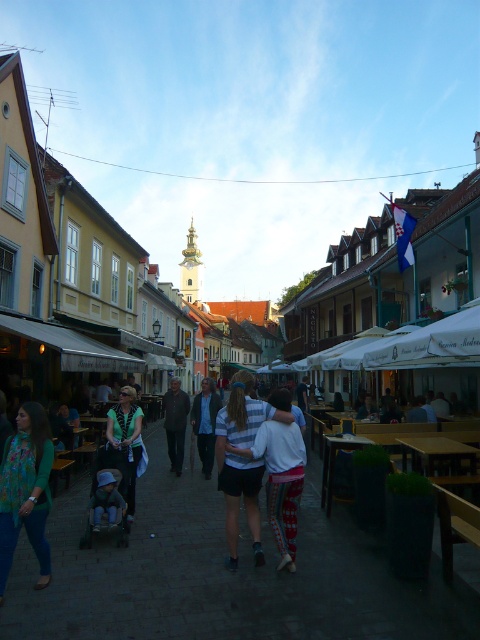
You are standing at the entrance of the street and want to locate the matte black stroller at center. According to the coordinates provided, in which direction should you look to find it?

The matte black stroller at center is located at coordinates point (x=220, y=576), which means it is positioned towards the lower right side of the image. You should look towards the lower right direction to find it.